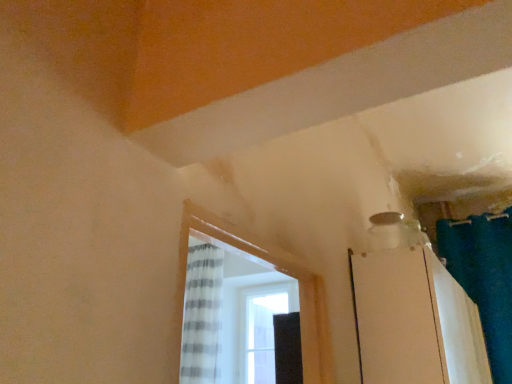
At what (x,y) coordinates should I click in order to perform the action: click on white glossy screen door at upper right. Please return your answer as a coordinate pair (x, y). Looking at the image, I should click on (397, 318).

What do you see at coordinates (397, 318) in the screenshot? The width and height of the screenshot is (512, 384). I see `white glossy screen door at upper right` at bounding box center [397, 318].

Describe the element at coordinates (484, 278) in the screenshot. I see `teal fabric shower curtain at upper right` at that location.

Find the location of a particular element. This screenshot has height=384, width=512. teal fabric shower curtain at upper right is located at coordinates (484, 278).

The image size is (512, 384). I want to click on white glossy screen door at upper right, so click(x=397, y=318).

From the picture: Which is more to the right, teal fabric shower curtain at upper right or white glossy screen door at upper right?

teal fabric shower curtain at upper right is more to the right.

In the image, is teal fabric shower curtain at upper right positioned in front of or behind white glossy screen door at upper right?

teal fabric shower curtain at upper right is behind white glossy screen door at upper right.

Between point (503, 312) and point (396, 352), which one is positioned in front?

The point (396, 352) is more forward.

From the image's perspective, is teal fabric shower curtain at upper right on white glossy screen door at upper right?

Correct, teal fabric shower curtain at upper right appears higher than white glossy screen door at upper right in the image.

From a real-world perspective, who is located lower, teal fabric shower curtain at upper right or white glossy screen door at upper right?

white glossy screen door at upper right.

Considering the sizes of objects teal fabric shower curtain at upper right and white glossy screen door at upper right in the image provided, who is wider, teal fabric shower curtain at upper right or white glossy screen door at upper right?

Wider between the two is white glossy screen door at upper right.

Is teal fabric shower curtain at upper right taller than white glossy screen door at upper right?

Correct, teal fabric shower curtain at upper right is much taller as white glossy screen door at upper right.

Can you confirm if teal fabric shower curtain at upper right is smaller than white glossy screen door at upper right?

Yes, teal fabric shower curtain at upper right is smaller than white glossy screen door at upper right.

Is teal fabric shower curtain at upper right not within white glossy screen door at upper right?

That's correct, teal fabric shower curtain at upper right is outside of white glossy screen door at upper right.

Is teal fabric shower curtain at upper right directly adjacent to white glossy screen door at upper right?

teal fabric shower curtain at upper right and white glossy screen door at upper right are not in contact.

Could you tell me if teal fabric shower curtain at upper right is turned towards white glossy screen door at upper right?

Yes, teal fabric shower curtain at upper right is facing white glossy screen door at upper right.

What are the coordinates of `shower curtain above the white glossy screen door at upper right (from the image's perspective)` in the screenshot? It's located at (484, 278).

Which object is positioned more to the left, white glossy screen door at upper right or teal fabric shower curtain at upper right?

white glossy screen door at upper right.

Is white glossy screen door at upper right in front of or behind teal fabric shower curtain at upper right in the image?

Clearly, white glossy screen door at upper right is in front of teal fabric shower curtain at upper right.

Between point (411, 296) and point (497, 232), which one is positioned in front?

The point (411, 296) is in front.

From the image's perspective, between white glossy screen door at upper right and teal fabric shower curtain at upper right, who is located below?

From the image's view, white glossy screen door at upper right is below.

From a real-world perspective, between white glossy screen door at upper right and teal fabric shower curtain at upper right, who is vertically lower?

In real-world perspective, white glossy screen door at upper right is lower.

Considering the sizes of objects white glossy screen door at upper right and teal fabric shower curtain at upper right in the image provided, who is wider, white glossy screen door at upper right or teal fabric shower curtain at upper right?

white glossy screen door at upper right.

Is white glossy screen door at upper right taller or shorter than teal fabric shower curtain at upper right?

Clearly, white glossy screen door at upper right is shorter compared to teal fabric shower curtain at upper right.

Looking at this image, is white glossy screen door at upper right smaller than teal fabric shower curtain at upper right?

No, white glossy screen door at upper right is not smaller than teal fabric shower curtain at upper right.

Could teal fabric shower curtain at upper right be considered to be inside white glossy screen door at upper right?

That's incorrect, teal fabric shower curtain at upper right is not inside white glossy screen door at upper right.

Is white glossy screen door at upper right next to teal fabric shower curtain at upper right?

No, white glossy screen door at upper right is not making contact with teal fabric shower curtain at upper right.

Is teal fabric shower curtain at upper right at the back of white glossy screen door at upper right?

No, white glossy screen door at upper right is not facing away from teal fabric shower curtain at upper right.

The height and width of the screenshot is (384, 512). Identify the location of screen door below the teal fabric shower curtain at upper right (from the image's perspective). (397, 318).

The height and width of the screenshot is (384, 512). In order to click on screen door that is on the left side of teal fabric shower curtain at upper right in this screenshot , I will do `click(397, 318)`.

This screenshot has width=512, height=384. Identify the location of shower curtain above the white glossy screen door at upper right (from a real-world perspective). (484, 278).